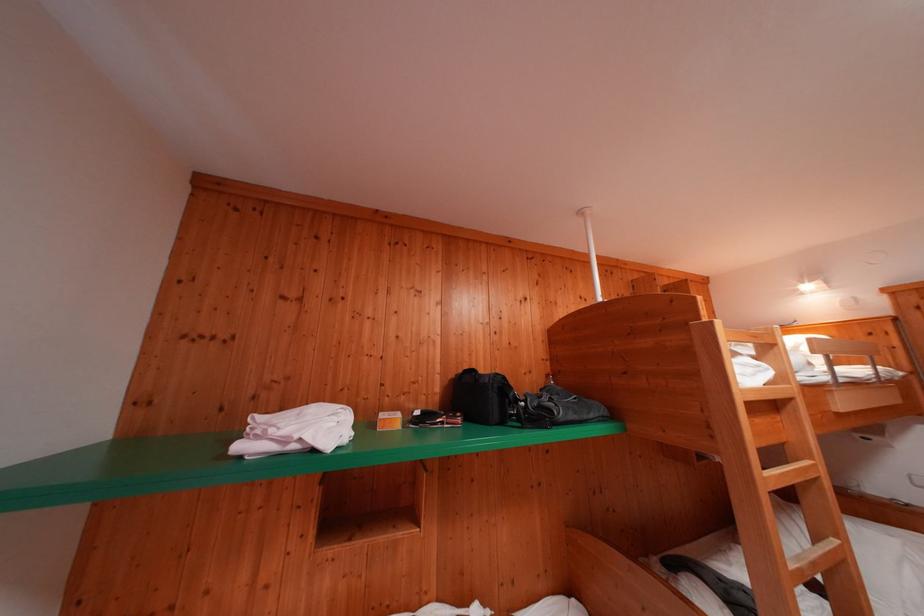
Find where to lift the black camera bag. Please return your answer as a coordinate pair (x, y).

(482, 397)